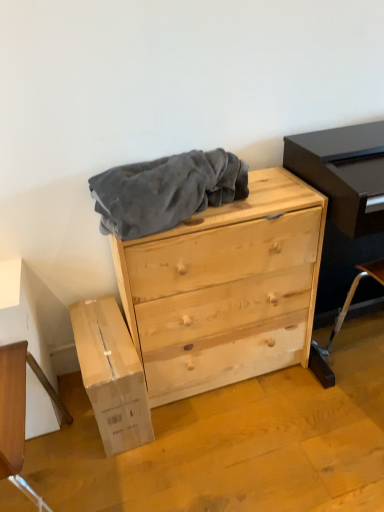
Question: Is natural wood chest of drawers at center taller than velvety gray blanket at center?

Choices:
 (A) no
 (B) yes

Answer: (B)

Question: Is velvety gray blanket at center at the back of natural wood chest of drawers at center?

Choices:
 (A) yes
 (B) no

Answer: (B)

Question: Is natural wood chest of drawers at center outside of velvety gray blanket at center?

Choices:
 (A) no
 (B) yes

Answer: (B)

Question: Considering the relative positions of natural wood chest of drawers at center and velvety gray blanket at center in the image provided, is natural wood chest of drawers at center to the left of velvety gray blanket at center from the viewer's perspective?

Choices:
 (A) yes
 (B) no

Answer: (B)

Question: From the image's perspective, is natural wood chest of drawers at center over velvety gray blanket at center?

Choices:
 (A) yes
 (B) no

Answer: (B)

Question: Looking at their shapes, would you say velvety gray blanket at center is wider or thinner than matte black entertainment center at right?

Choices:
 (A) wide
 (B) thin

Answer: (B)

Question: Is velvety gray blanket at center taller or shorter than matte black entertainment center at right?

Choices:
 (A) tall
 (B) short

Answer: (B)

Question: From a real-world perspective, is velvety gray blanket at center positioned above or below matte black entertainment center at right?

Choices:
 (A) above
 (B) below

Answer: (A)

Question: Is velvety gray blanket at center to the left or to the right of matte black entertainment center at right in the image?

Choices:
 (A) left
 (B) right

Answer: (A)

Question: Based on their sizes in the image, would you say natural wood chest of drawers at center is bigger or smaller than velvety gray blanket at center?

Choices:
 (A) big
 (B) small

Answer: (A)

Question: Considering the positions of natural wood chest of drawers at center and velvety gray blanket at center in the image, is natural wood chest of drawers at center wider or thinner than velvety gray blanket at center?

Choices:
 (A) thin
 (B) wide

Answer: (B)

Question: In the image, is natural wood chest of drawers at center on the left side or the right side of velvety gray blanket at center?

Choices:
 (A) left
 (B) right

Answer: (B)

Question: In terms of height, does natural wood chest of drawers at center look taller or shorter compared to velvety gray blanket at center?

Choices:
 (A) short
 (B) tall

Answer: (B)

Question: Looking at their shapes, would you say natural wood chest of drawers at center is wider or thinner than matte black entertainment center at right?

Choices:
 (A) wide
 (B) thin

Answer: (A)

Question: From a real-world perspective, is natural wood chest of drawers at center above or below matte black entertainment center at right?

Choices:
 (A) above
 (B) below

Answer: (B)